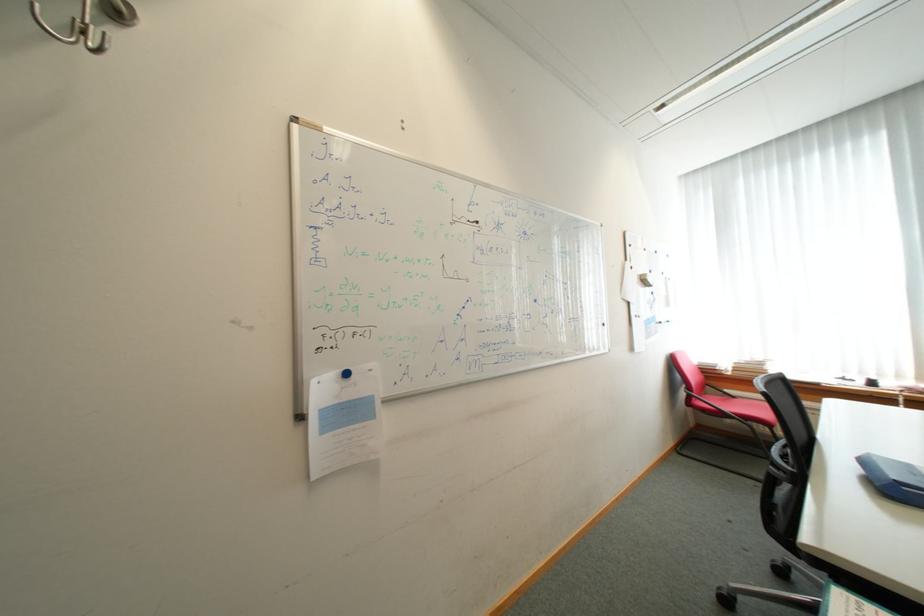
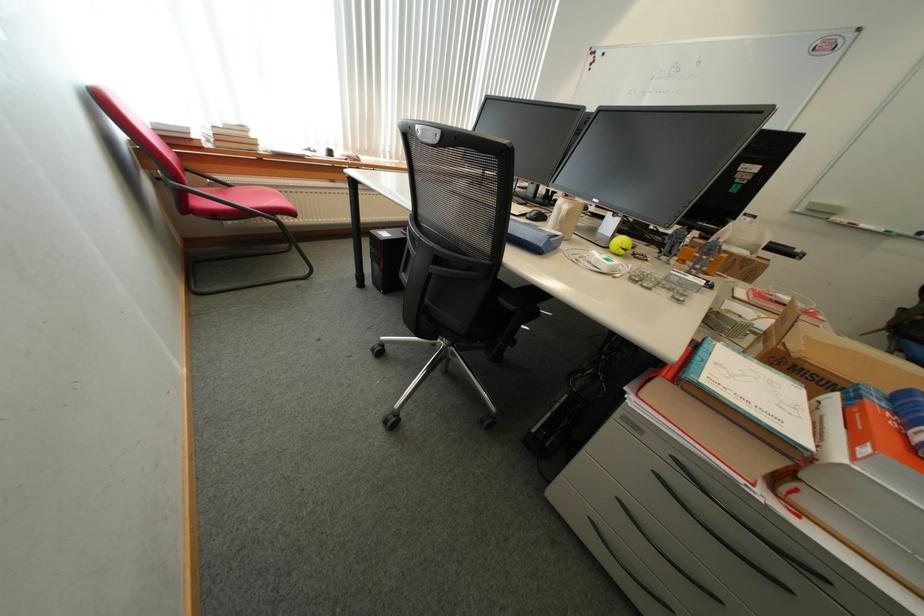
Locate, in the second image, the point that corresponds to point (743, 398) in the first image.

(237, 187)